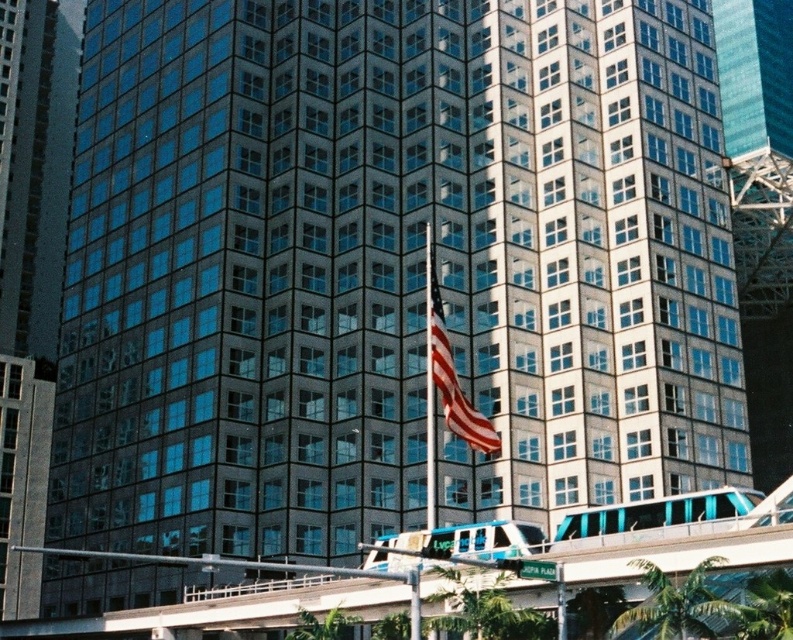
Who is positioned more to the right, teal glossy train at center or american flag at center?

teal glossy train at center

The width and height of the screenshot is (793, 640). What do you see at coordinates (657, 513) in the screenshot? I see `teal glossy train at center` at bounding box center [657, 513].

Where is `teal glossy train at center`? This screenshot has width=793, height=640. teal glossy train at center is located at coordinates (657, 513).

Which is behind, point (691, 618) or point (470, 440)?

Point (470, 440)

Does green leafy palm tree at lower right lie behind american flag at center?

No, it is in front of american flag at center.

Does point (711, 637) come farther from viewer compared to point (437, 342)?

No, (711, 637) is in front of (437, 342).

Where is `green leafy palm tree at lower right`? The width and height of the screenshot is (793, 640). green leafy palm tree at lower right is located at coordinates (676, 604).

Looking at this image, is green leafy palm tree at lower right to the left of teal glossy monorail at center from the viewer's perspective?

No, green leafy palm tree at lower right is not to the left of teal glossy monorail at center.

From the picture: Is green leafy palm tree at lower right bigger than teal glossy monorail at center?

Actually, green leafy palm tree at lower right might be smaller than teal glossy monorail at center.

Does point (717, 563) come farther from viewer compared to point (385, 536)?

No.

Locate an element on the screen. green leafy palm tree at lower right is located at coordinates (676, 604).